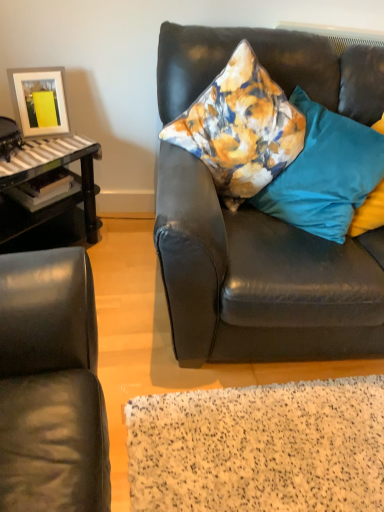
Question: Is floral fabric pillow at upper right, the third pillow viewed from the right, inside teal fabric pillow at right, which is the 1th pillow in right-to-left order?

Choices:
 (A) yes
 (B) no

Answer: (B)

Question: From the image's perspective, is teal fabric pillow at right, which is the 1th pillow in right-to-left order, above floral fabric pillow at upper right, the third pillow viewed from the right?

Choices:
 (A) yes
 (B) no

Answer: (B)

Question: Considering the relative sizes of teal fabric pillow at right, the 3th pillow in the left-to-right sequence, and floral fabric pillow at upper right, the third pillow viewed from the right, in the image provided, is teal fabric pillow at right, the 3th pillow in the left-to-right sequence, thinner than floral fabric pillow at upper right, the third pillow viewed from the right,?

Choices:
 (A) no
 (B) yes

Answer: (B)

Question: Is teal fabric pillow at right, the 3th pillow in the left-to-right sequence, aimed at floral fabric pillow at upper right, acting as the first pillow starting from the left?

Choices:
 (A) yes
 (B) no

Answer: (B)

Question: Considering the relative sizes of teal fabric pillow at right, the 3th pillow in the left-to-right sequence, and floral fabric pillow at upper right, the third pillow viewed from the right, in the image provided, is teal fabric pillow at right, the 3th pillow in the left-to-right sequence, bigger than floral fabric pillow at upper right, the third pillow viewed from the right,?

Choices:
 (A) yes
 (B) no

Answer: (B)

Question: Is matte white picture frame at upper left situated inside floral fabric pillow at upper right, the third pillow viewed from the right, or outside?

Choices:
 (A) inside
 (B) outside

Answer: (B)

Question: Considering the relative positions of matte white picture frame at upper left and floral fabric pillow at upper right, the third pillow viewed from the right, in the image provided, is matte white picture frame at upper left to the left or to the right of floral fabric pillow at upper right, the third pillow viewed from the right,?

Choices:
 (A) left
 (B) right

Answer: (A)

Question: Does point (64, 109) appear closer or farther from the camera than point (213, 92)?

Choices:
 (A) closer
 (B) farther

Answer: (B)

Question: Considering the positions of matte white picture frame at upper left and floral fabric pillow at upper right, the third pillow viewed from the right, in the image, is matte white picture frame at upper left wider or thinner than floral fabric pillow at upper right, the third pillow viewed from the right,?

Choices:
 (A) thin
 (B) wide

Answer: (A)

Question: Considering the relative positions of teal fabric pillow at right, which is the 1th pillow in right-to-left order, and velvet floral pillow at center, which appears as the 2th pillow when viewed from the left, in the image provided, is teal fabric pillow at right, which is the 1th pillow in right-to-left order, to the left or to the right of velvet floral pillow at center, which appears as the 2th pillow when viewed from the left,?

Choices:
 (A) left
 (B) right

Answer: (B)

Question: Relative to velvet floral pillow at center, which is the second pillow from right to left, is teal fabric pillow at right, which is the 1th pillow in right-to-left order, in front or behind?

Choices:
 (A) behind
 (B) front

Answer: (A)

Question: Is teal fabric pillow at right, which is the 1th pillow in right-to-left order, spatially inside velvet floral pillow at center, which is the second pillow from right to left, or outside of it?

Choices:
 (A) outside
 (B) inside

Answer: (A)

Question: From the image's perspective, is teal fabric pillow at right, the 3th pillow in the left-to-right sequence, above or below velvet floral pillow at center, which is the second pillow from right to left?

Choices:
 (A) below
 (B) above

Answer: (B)

Question: Considering their positions, is floral fabric pillow at upper right, the third pillow viewed from the right, located in front of or behind teal fabric pillow at right, the 3th pillow in the left-to-right sequence?

Choices:
 (A) behind
 (B) front

Answer: (B)

Question: From their relative heights in the image, would you say floral fabric pillow at upper right, the third pillow viewed from the right, is taller or shorter than teal fabric pillow at right, which is the 1th pillow in right-to-left order?

Choices:
 (A) short
 (B) tall

Answer: (B)